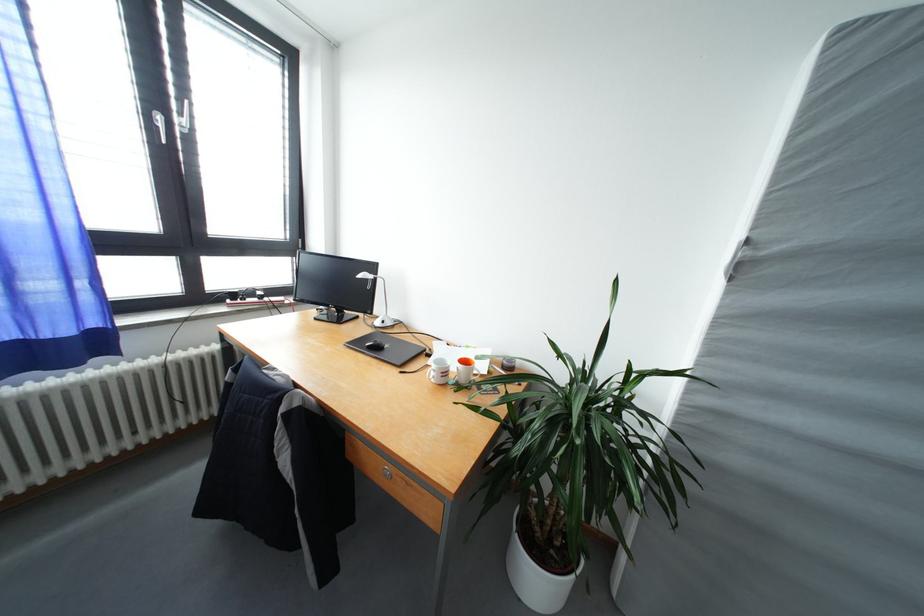
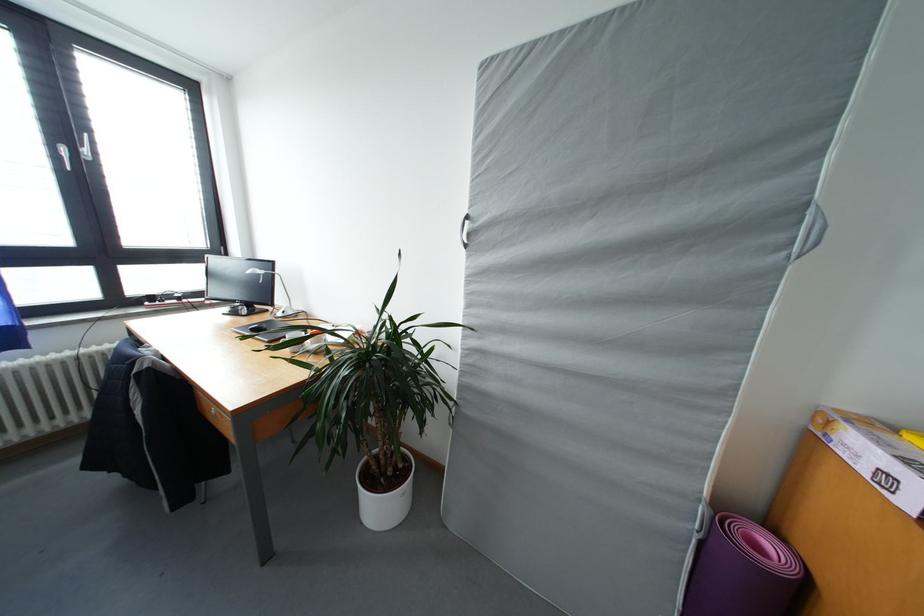
The point at (x=754, y=246) is marked in the first image. Where is the corresponding point in the second image?

(473, 222)